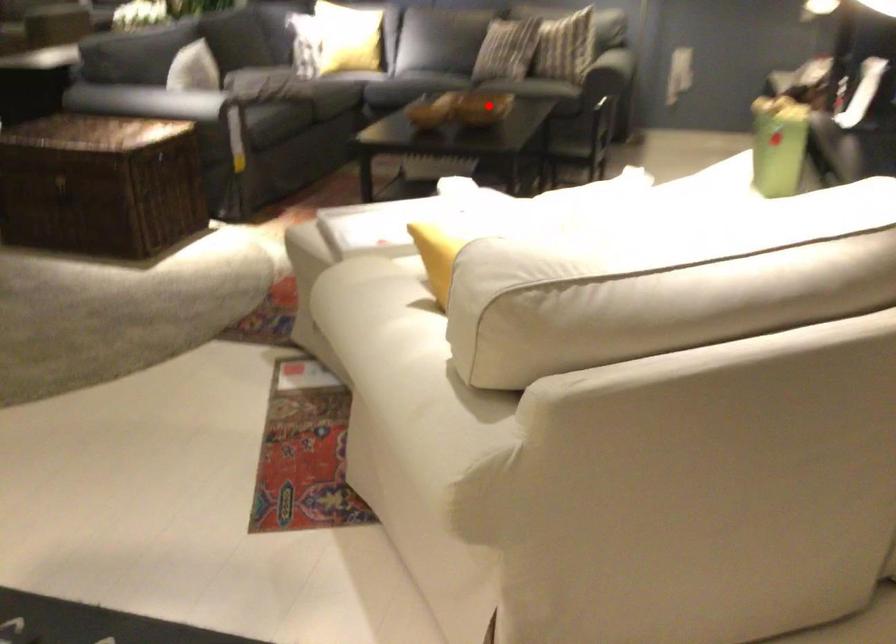
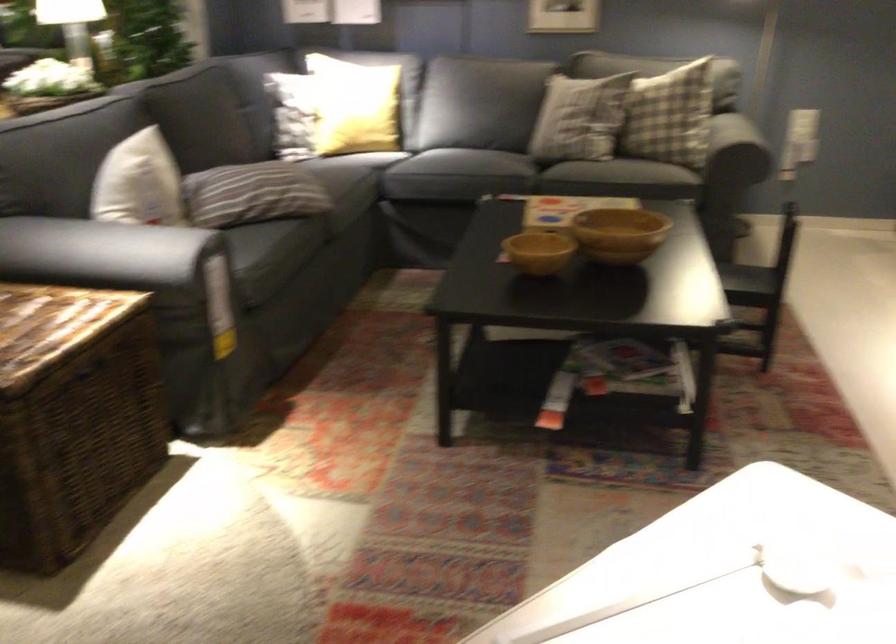
Locate, in the second image, the point that corresponds to the highlighted location in the first image.

(618, 234)